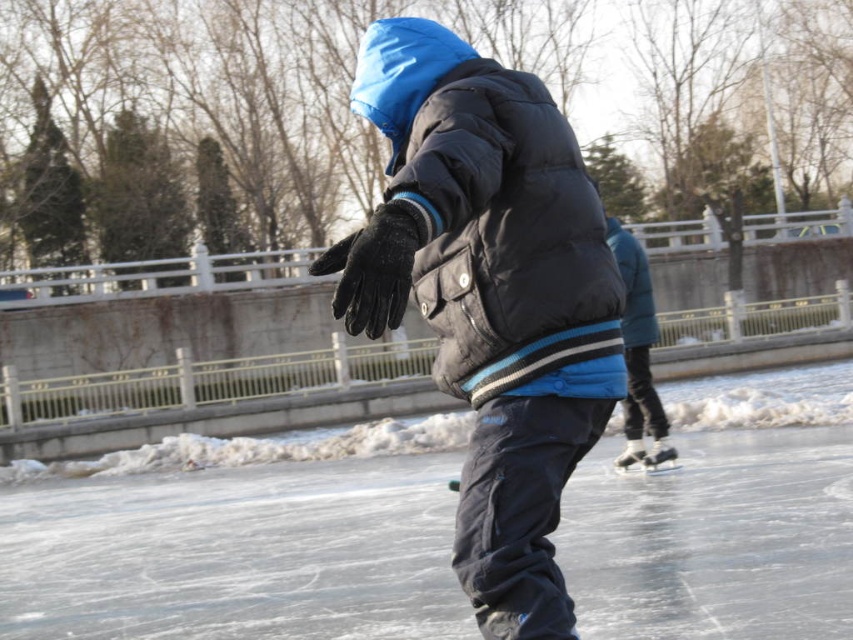
You are an ice skater standing at the point closer to the foreground. You see two points marked on the ice surface, point 1 at coordinates point (535, 534) and point 2 at coordinates point (500, 218). Which point is closer to your current position?

Point 1 at coordinates point (535, 534) is closer to your current position because it is further to the viewer than point 2 at coordinates point (500, 218).

In the scene shown: You are an ice rink attendant who needs to ensure safety between skaters. The minimum safe distance between skaters is 2 inches. Are the matte black jacket at center and black puffy jacket at center maintaining a safe distance?

The distance between the matte black jacket at center and the black puffy jacket at center is 2.37 inches, which exceeds the minimum safe distance of 2 inches. Therefore, they are maintaining a safe distance.

You are an observer watching two skaters on the ice. You see a matte black jacket at center and a black puffy jacket at center. Which one takes up more space in the image?

The matte black jacket at center is larger in size than the black puffy jacket at center, so it takes up more space in the image.